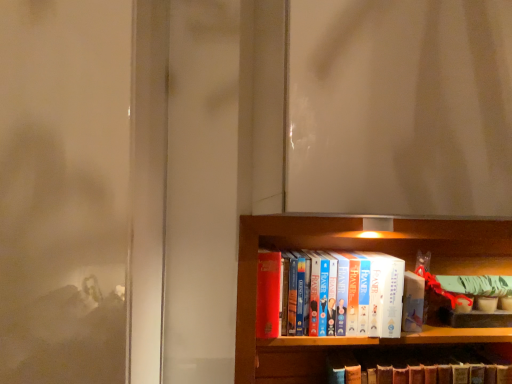
Question: Can you confirm if hardcover book at center, acting as the 2th book starting from the bottom, is positioned to the left of hardcover book at center, placed as the first book when sorted from bottom to top?

Choices:
 (A) no
 (B) yes

Answer: (B)

Question: Is the depth of hardcover book at center, acting as the 2th book starting from the bottom, greater than that of hardcover book at center, acting as the second book starting from the top?

Choices:
 (A) no
 (B) yes

Answer: (A)

Question: Are hardcover book at center, acting as the 2th book starting from the bottom, and hardcover book at center, placed as the first book when sorted from bottom to top, making contact?

Choices:
 (A) yes
 (B) no

Answer: (B)

Question: Considering the relative sizes of hardcover book at center, acting as the 2th book starting from the bottom, and hardcover book at center, acting as the second book starting from the top, in the image provided, is hardcover book at center, acting as the 2th book starting from the bottom, taller than hardcover book at center, acting as the second book starting from the top,?

Choices:
 (A) yes
 (B) no

Answer: (A)

Question: From the image's perspective, is hardcover book at center, acting as the 2th book starting from the bottom, beneath hardcover book at center, placed as the first book when sorted from bottom to top?

Choices:
 (A) yes
 (B) no

Answer: (B)

Question: Is hardcover book at center, acting as the 2th book starting from the bottom, in front of hardcover book at center, acting as the second book starting from the top?

Choices:
 (A) no
 (B) yes

Answer: (B)

Question: From the image's perspective, does hardcover book at center, placed as the first book when sorted from bottom to top, appear higher than hardcover book at center, positioned as the 1th book in top-to-bottom order?

Choices:
 (A) no
 (B) yes

Answer: (A)

Question: Does hardcover book at center, acting as the second book starting from the top, touch hardcover book at center, acting as the 2th book starting from the bottom?

Choices:
 (A) no
 (B) yes

Answer: (A)

Question: Is hardcover book at center, acting as the second book starting from the top, at the left side of hardcover book at center, positioned as the 1th book in top-to-bottom order?

Choices:
 (A) yes
 (B) no

Answer: (B)

Question: Does hardcover book at center, acting as the second book starting from the top, have a greater height compared to hardcover book at center, positioned as the 1th book in top-to-bottom order?

Choices:
 (A) yes
 (B) no

Answer: (B)

Question: From a real-world perspective, is hardcover book at center, acting as the second book starting from the top, under hardcover book at center, acting as the 2th book starting from the bottom?

Choices:
 (A) yes
 (B) no

Answer: (A)

Question: Is hardcover book at center, acting as the 2th book starting from the bottom, completely or partially inside hardcover book at center, placed as the first book when sorted from bottom to top?

Choices:
 (A) no
 (B) yes

Answer: (A)

Question: Considering their positions, is hardcover book at center, placed as the first book when sorted from bottom to top, located in front of or behind hardcover book at center, acting as the 2th book starting from the bottom?

Choices:
 (A) front
 (B) behind

Answer: (B)